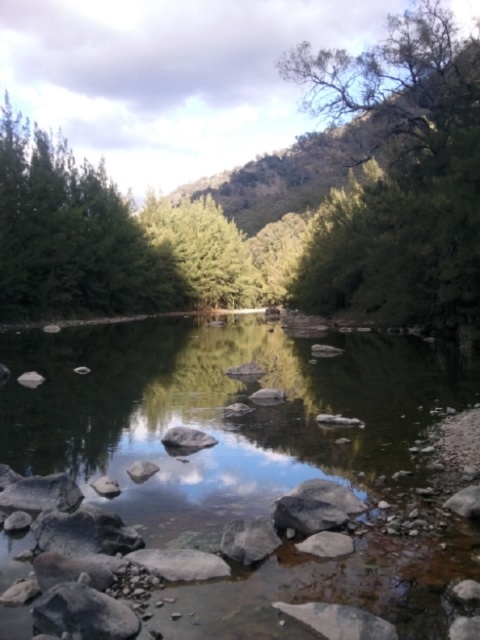
Which of these two, green leafy tree at upper right or green matte tree at center, stands taller?

green matte tree at center

Does point (360, 241) lie behind point (189, 202)?

No, (360, 241) is closer to viewer.

Where is `green leafy tree at upper right`? The height and width of the screenshot is (640, 480). green leafy tree at upper right is located at coordinates (400, 176).

This screenshot has width=480, height=640. I want to click on smooth rock stream at center, so click(222, 413).

Can you confirm if smooth rock stream at center is smaller than green leafy tree at upper right?

Correct, smooth rock stream at center occupies less space than green leafy tree at upper right.

Is point (162, 380) behind point (432, 237)?

No.

At what (x,y) coordinates should I click in order to perform the action: click on smooth rock stream at center. Please return your answer as a coordinate pair (x, y). Image resolution: width=480 pixels, height=640 pixels. Looking at the image, I should click on (222, 413).

Consider the image. Which is more to the right, green leafy tree at upper right or smooth gray rock at center?

From the viewer's perspective, green leafy tree at upper right appears more on the right side.

Describe the element at coordinates (400, 176) in the screenshot. I see `green leafy tree at upper right` at that location.

Locate an element on the screen. This screenshot has height=640, width=480. green leafy tree at upper right is located at coordinates (400, 176).